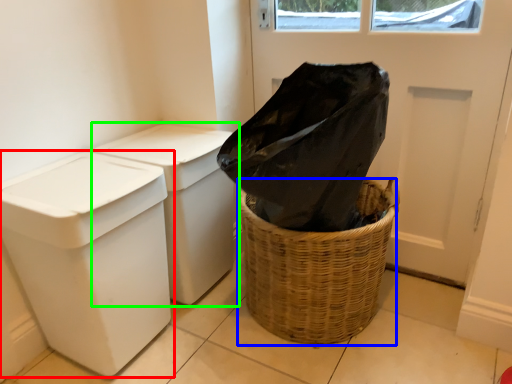
Question: Which is nearer to the waste container (highlighted by a red box)? basket container (highlighted by a blue box) or waste container (highlighted by a green box).

Choices:
 (A) basket container
 (B) waste container

Answer: (B)